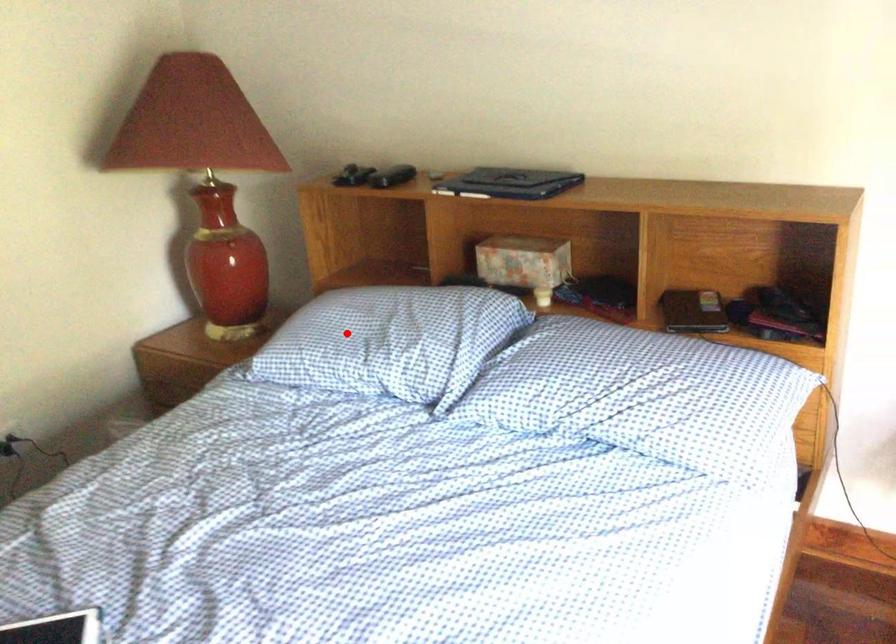
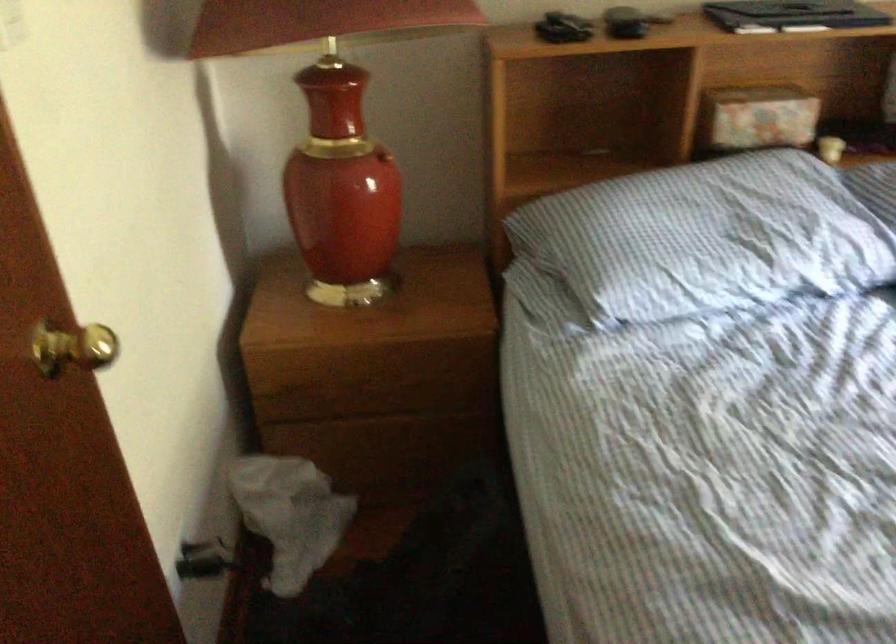
In the second image, find the point that corresponds to the highlighted location in the first image.

(707, 238)